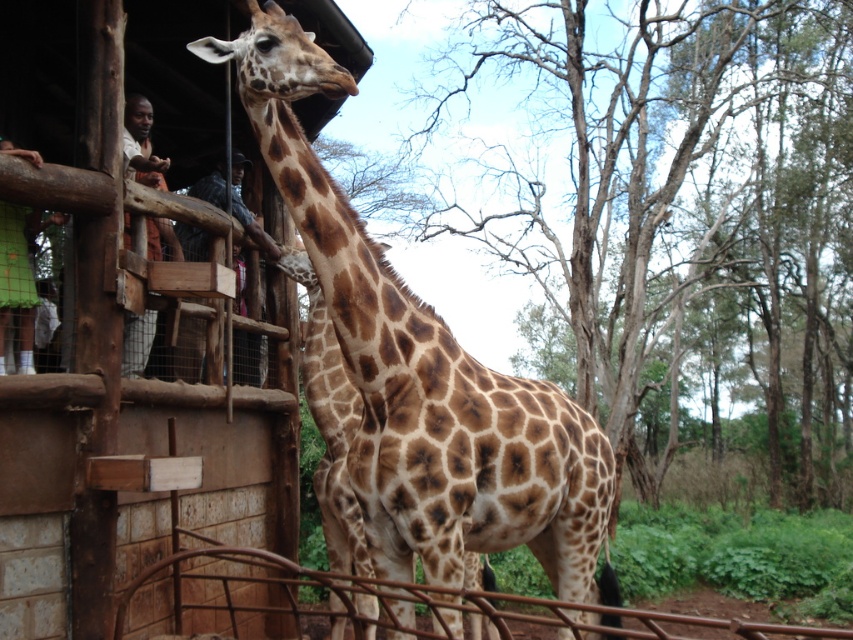
Question: Which object appears farthest from the camera in this image?

Choices:
 (A) brown metal rail at lower center
 (B) brown spotted giraffe at center

Answer: (B)

Question: Does brown metal rail at lower center have a larger size compared to green mesh shirt at left?

Choices:
 (A) no
 (B) yes

Answer: (A)

Question: Which point is farther to the camera?

Choices:
 (A) (329, 568)
 (B) (141, 360)
 (C) (22, 317)

Answer: (A)

Question: Can you confirm if brown metal rail at lower center is smaller than striped fabric shirt at upper left?

Choices:
 (A) yes
 (B) no

Answer: (A)

Question: Is brown spotted giraffe at center bigger than light brown wood at left?

Choices:
 (A) no
 (B) yes

Answer: (B)

Question: Which object appears closest to the camera in this image?

Choices:
 (A) brown spotted fur at center
 (B) striped fabric shirt at upper left
 (C) green mesh shirt at left

Answer: (C)